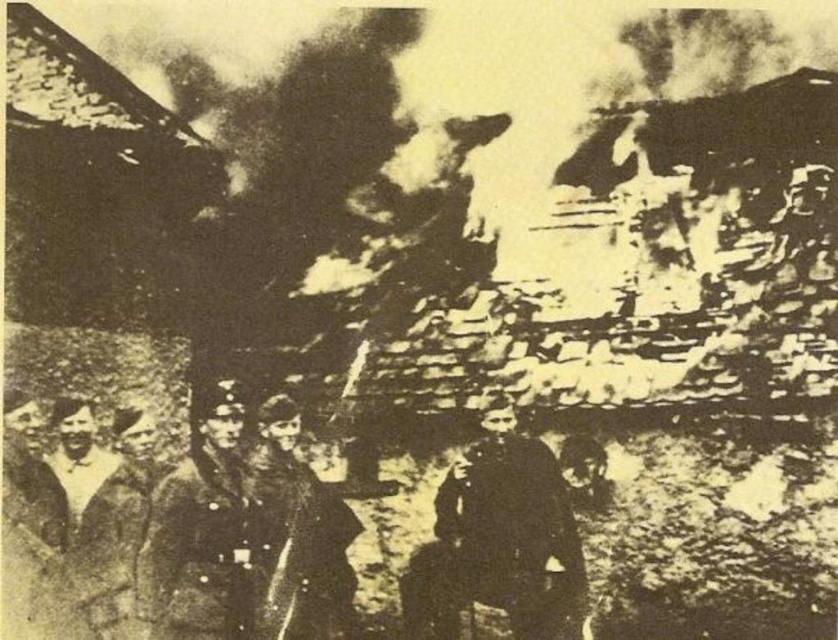
Question: Which of the following is the farthest from the observer?

Choices:
 (A) (428, 600)
 (B) (286, 518)
 (C) (83, 420)

Answer: (A)

Question: Is dark gray uniform at center further to the viewer compared to dark gray fur coat at center?

Choices:
 (A) yes
 (B) no

Answer: (B)

Question: Considering the relative positions of dark gray wool coat at center and dark gray uniform at center in the image provided, where is dark gray wool coat at center located with respect to dark gray uniform at center?

Choices:
 (A) left
 (B) right

Answer: (B)

Question: Among these objects, which one is farthest from the camera?

Choices:
 (A) dark gray uniform at center
 (B) dark gray wool coat at center

Answer: (B)

Question: Considering the real-world distances, which object is farthest from the dark gray uniform at center?

Choices:
 (A) dark gray wool coat at lower left
 (B) dark gray fur coat at center
 (C) dark gray wool coat at center

Answer: (C)

Question: Does dark gray wool coat at center appear under dark gray uniform at center?

Choices:
 (A) yes
 (B) no

Answer: (A)